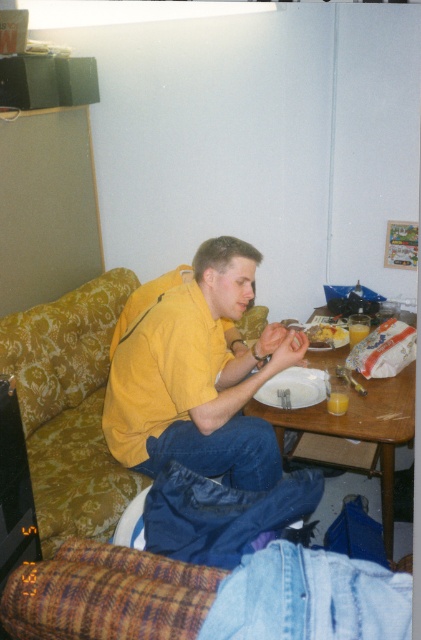
Question: Where is yellow matte shirt at center located in relation to wooden table at center in the image?

Choices:
 (A) right
 (B) left

Answer: (B)

Question: Is wooden table at center to the right of yellowish matte plate at center from the viewer's perspective?

Choices:
 (A) no
 (B) yes

Answer: (B)

Question: Which object is closer to the camera taking this photo?

Choices:
 (A) yellowish matte plate at center
 (B) yellow matte shirt at center

Answer: (B)

Question: Which point is closer to the camera taking this photo?

Choices:
 (A) (74, 445)
 (B) (341, 328)
 (C) (277, 324)
 (D) (391, 384)

Answer: (D)

Question: In this image, where is yellow matte shirt at center located relative to wooden table at center?

Choices:
 (A) above
 (B) below

Answer: (A)

Question: Which point is farther from the camera taking this photo?

Choices:
 (A) (79, 372)
 (B) (314, 340)
 (C) (391, 417)

Answer: (A)